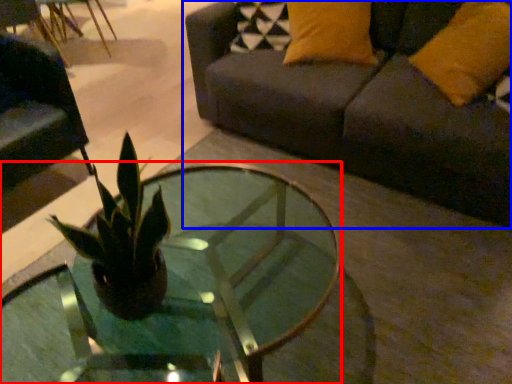
Question: Which of the following is the farthest to the observer, coffee table (highlighted by a red box) or studio couch (highlighted by a blue box)?

Choices:
 (A) coffee table
 (B) studio couch

Answer: (B)